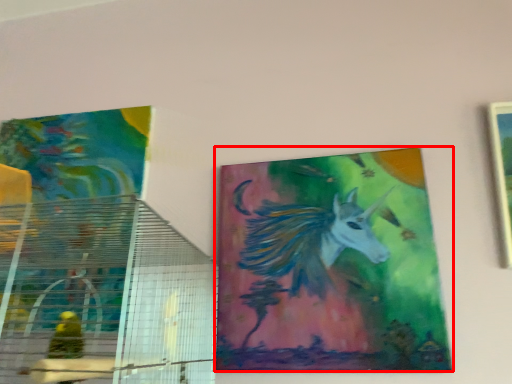
Question: From the image, what is the correct spatial relationship of picture frame (annotated by the red box) in relation to picture frame?

Choices:
 (A) left
 (B) right

Answer: (A)